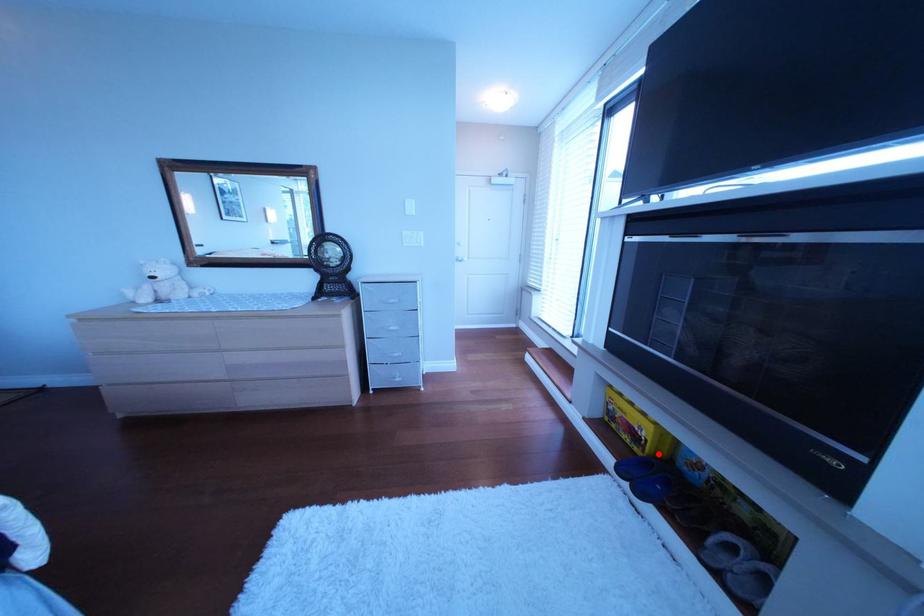
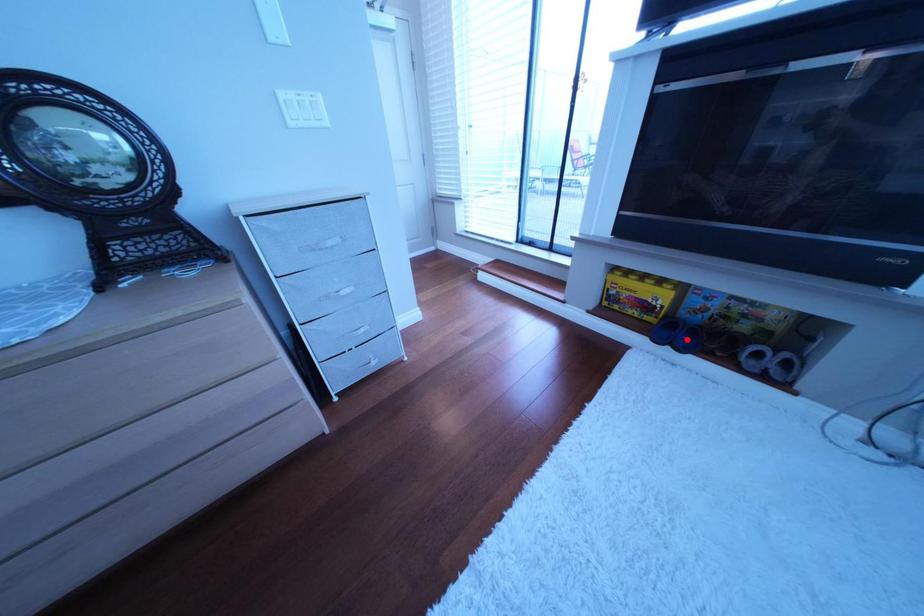
I am providing you with two images of the same scene from different viewpoints. A red point is marked on the first image and another point is marked on the second image. Is the marked point in image1 the same physical position as the marked point in image2?

No